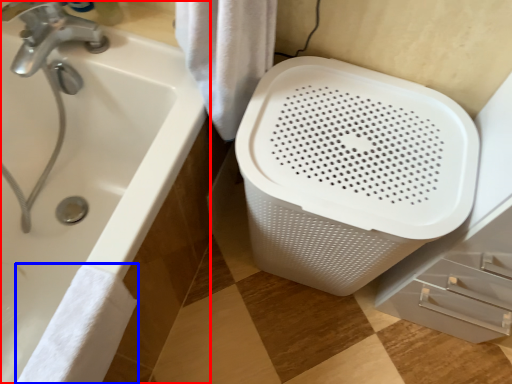
Question: Which of the following is the farthest to the observer, bathtub (highlighted by a red box) or bath towel (highlighted by a blue box)?

Choices:
 (A) bathtub
 (B) bath towel

Answer: (A)